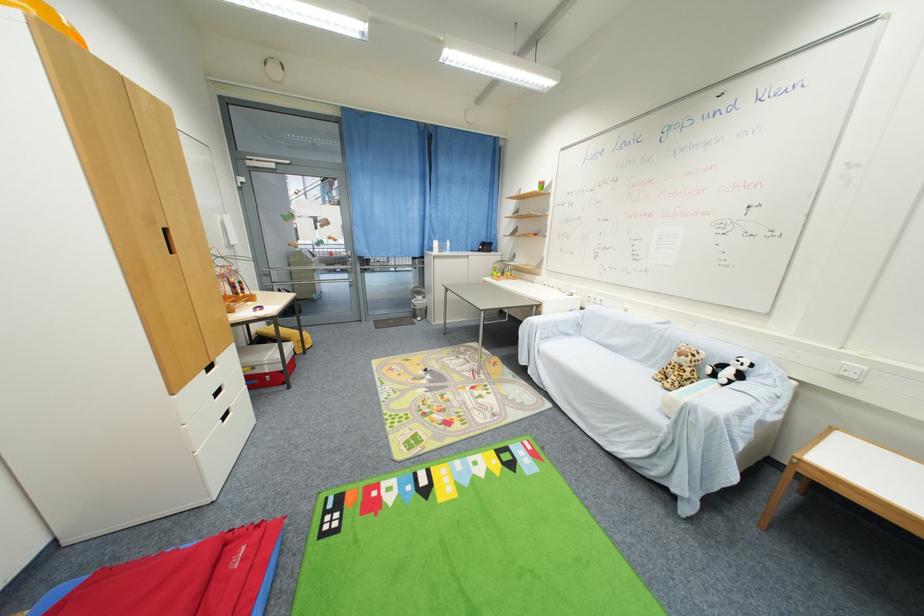
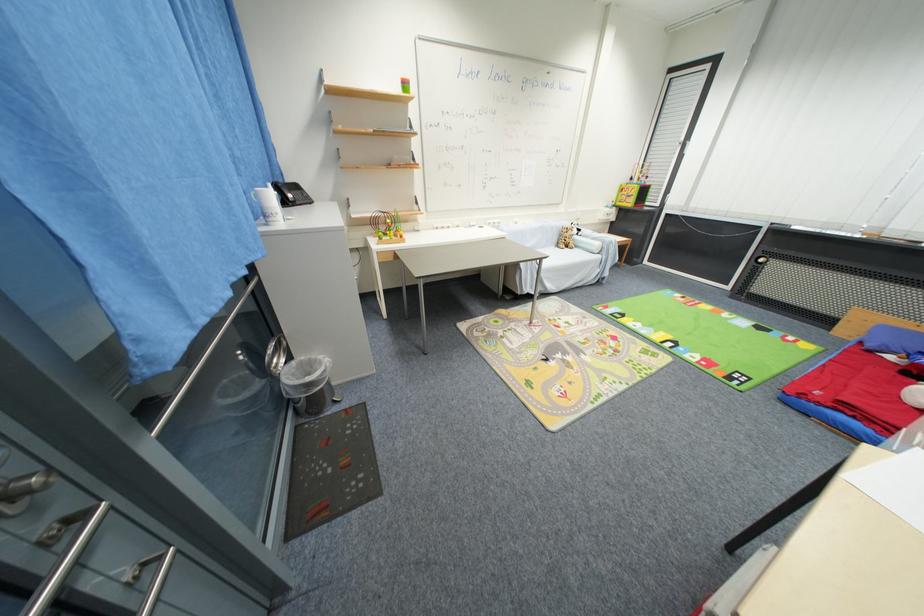
Locate, in the second image, the point that corresponds to (429,300) in the first image.

(295, 360)